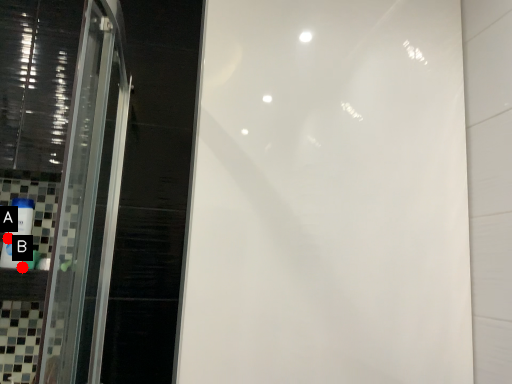
Question: Two points are circled on the image, labeled by A and B beside each circle. Among these points, which one is nearest to the camera?

Choices:
 (A) A is closer
 (B) B is closer

Answer: (A)